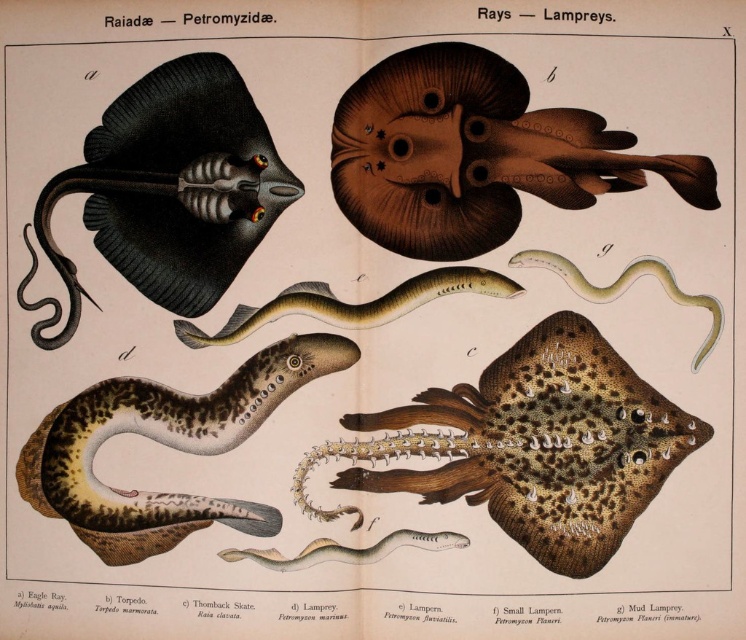
Is brown matte ray at upper center below black matte stingray at upper left?

No, brown matte ray at upper center is not below black matte stingray at upper left.

Does brown matte ray at upper center come behind black matte stingray at upper left?

No, brown matte ray at upper center is in front of black matte stingray at upper left.

At what (x,y) coordinates should I click in order to perform the action: click on brown matte ray at upper center. Please return your answer as a coordinate pair (x, y). Looking at the image, I should click on (474, 154).

Who is positioned more to the left, brown matte ray at upper center or green smooth snake at center?

brown matte ray at upper center is more to the left.

Is brown matte ray at upper center positioned before green smooth snake at center?

Yes, brown matte ray at upper center is in front of green smooth snake at center.

This screenshot has height=640, width=746. What do you see at coordinates (474, 154) in the screenshot?
I see `brown matte ray at upper center` at bounding box center [474, 154].

Where is `brown matte ray at upper center`? The image size is (746, 640). brown matte ray at upper center is located at coordinates (474, 154).

Who is higher up, black matte stingray at upper left or yellow-green textured snake at center?

black matte stingray at upper left

Which of these two, black matte stingray at upper left or yellow-green textured snake at center, stands shorter?

yellow-green textured snake at center

Which is in front, point (157, 202) or point (260, 310)?

Point (260, 310) is more forward.

Identify the location of black matte stingray at upper left. (169, 189).